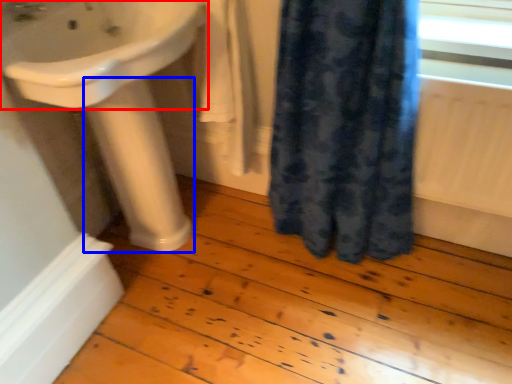
Question: Which object appears farthest to the camera in this image, sink (highlighted by a red box) or pillar (highlighted by a blue box)?

Choices:
 (A) sink
 (B) pillar

Answer: (B)